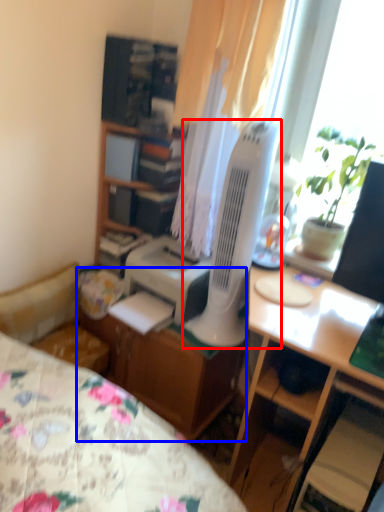
Question: Which point is further to the camera, mechanical fan (highlighted by a red box) or file cabinet (highlighted by a blue box)?

Choices:
 (A) mechanical fan
 (B) file cabinet

Answer: (B)